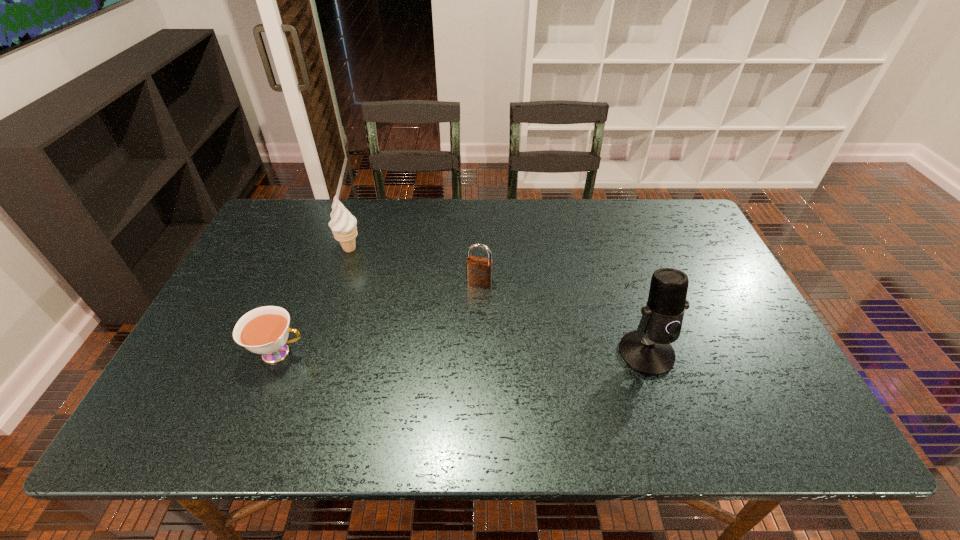
The width and height of the screenshot is (960, 540). What are the coordinates of `free space on the desktop that is between the teacup and the rightmost object and is positioned on the front-facing side of the third object from left to right` in the screenshot? It's located at (459, 353).

Identify the location of free space on the desktop that is between the teacup and the tallest object and is positioned on the front-facing side of the second tallest object. pos(443,353).